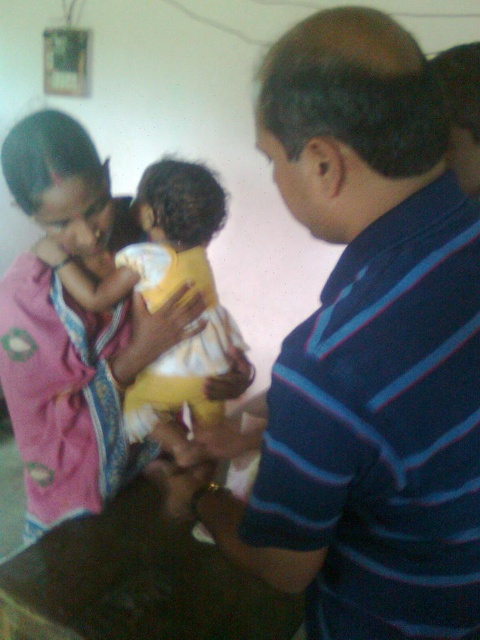
You are a photographer trying to capture a closeup of the yellow cotton baby at center without including the blue striped shirt at center in the frame. Is this possible given their current positions?

The blue striped shirt at center is positioned under the yellow cotton baby at center, so it might be challenging to capture the baby without including the shirt in the frame since the shirt is directly beneath it.

You are designing a new clothing line for parents and infants. Based on the image, which item has a smaller width between the blue striped shirt at center and the yellow cotton baby at center?

The blue striped shirt at center has a smaller width than the yellow cotton baby at center.